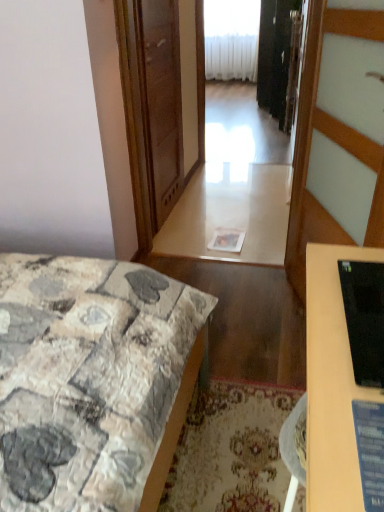
Question: Is transparent glass screen door at center positioned far away from white plastic radiator at upper center?

Choices:
 (A) no
 (B) yes

Answer: (B)

Question: Can you confirm if transparent glass screen door at center is positioned to the left of white plastic radiator at upper center?

Choices:
 (A) yes
 (B) no

Answer: (A)

Question: Does transparent glass screen door at center have a lesser width compared to white plastic radiator at upper center?

Choices:
 (A) no
 (B) yes

Answer: (B)

Question: Could you tell me if transparent glass screen door at center is facing white plastic radiator at upper center?

Choices:
 (A) no
 (B) yes

Answer: (A)

Question: Can you confirm if transparent glass screen door at center is taller than white plastic radiator at upper center?

Choices:
 (A) yes
 (B) no

Answer: (B)

Question: Is point (210, 52) closer or farther from the camera than point (163, 200)?

Choices:
 (A) farther
 (B) closer

Answer: (A)

Question: From a real-world perspective, is white plastic radiator at upper center positioned above or below transparent glass screen door at center?

Choices:
 (A) above
 (B) below

Answer: (B)

Question: Is white plastic radiator at upper center wider or thinner than transparent glass screen door at center?

Choices:
 (A) thin
 (B) wide

Answer: (B)

Question: In the image, is white plastic radiator at upper center positioned in front of or behind transparent glass screen door at center?

Choices:
 (A) front
 (B) behind

Answer: (B)

Question: In the image, is white glossy table at center on the left side or the right side of transparent glass screen door at center?

Choices:
 (A) left
 (B) right

Answer: (B)

Question: Is white glossy table at center taller or shorter than transparent glass screen door at center?

Choices:
 (A) short
 (B) tall

Answer: (A)

Question: In terms of width, does white glossy table at center look wider or thinner when compared to transparent glass screen door at center?

Choices:
 (A) thin
 (B) wide

Answer: (B)

Question: From a real-world perspective, is white glossy table at center above or below transparent glass screen door at center?

Choices:
 (A) above
 (B) below

Answer: (B)

Question: Does point (225, 390) appear closer or farther from the camera than point (48, 282)?

Choices:
 (A) closer
 (B) farther

Answer: (B)

Question: In terms of height, does carpeted mat at lower center look taller or shorter compared to patchwork fabric bed at lower left?

Choices:
 (A) short
 (B) tall

Answer: (A)